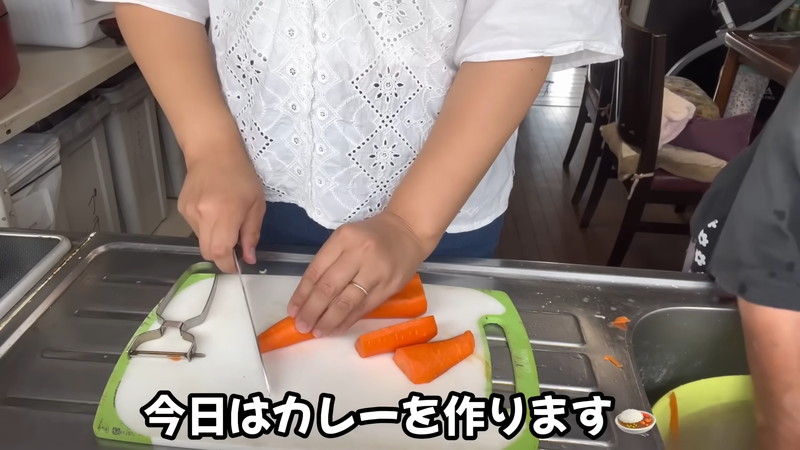
At what (x,y) coordinates should I click in order to perform the action: click on utensil you would use to peel a vegetable or fruit. Please return your answer as a coordinate pair (x, y). Looking at the image, I should click on (186, 328).